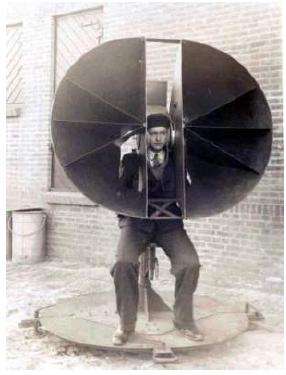
Identify the location of wall. This screenshot has width=286, height=375. (230, 249), (31, 145).